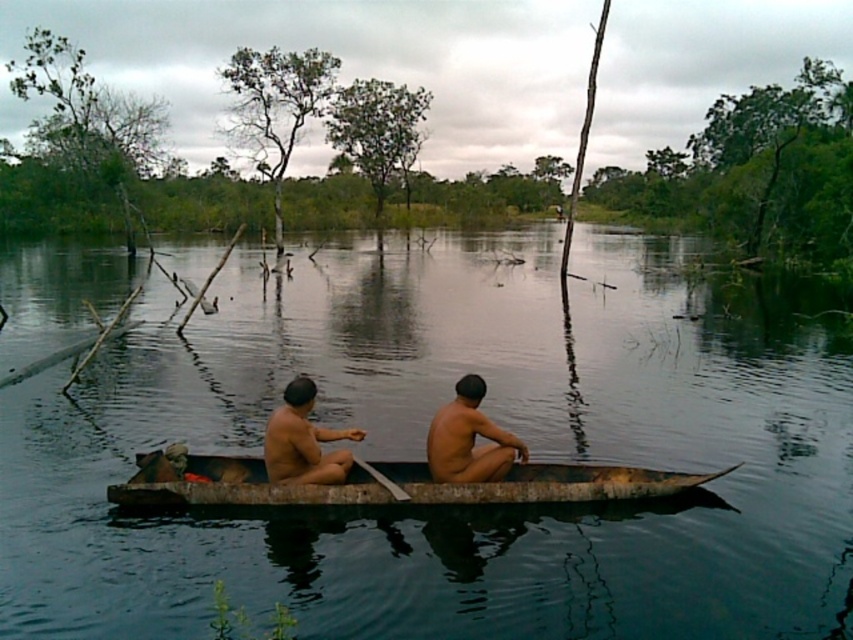
You are a photographer trying to capture a photo of the wooden canoe at center and the brown skin man at center. Since the camera has a limited depth of field, you can only focus on one of them. Which object should you focus on to ensure the other remains in the background?

The wooden canoe at center is larger in size than the brown skin man at center, so focusing on the wooden canoe at center would keep the brown skin man at center in the background.

You are a photographer trying to capture the two individuals in the boat. Since you want to focus on their skin tones, which object should you zoom in on more to ensure the naked skin at center is adequately highlighted compared to the brown skin man at center?

The naked skin at center is bigger than the brown skin man at center, so you should zoom in more on the naked skin at center to ensure it is highlighted appropriately compared to the brown skin man at center.